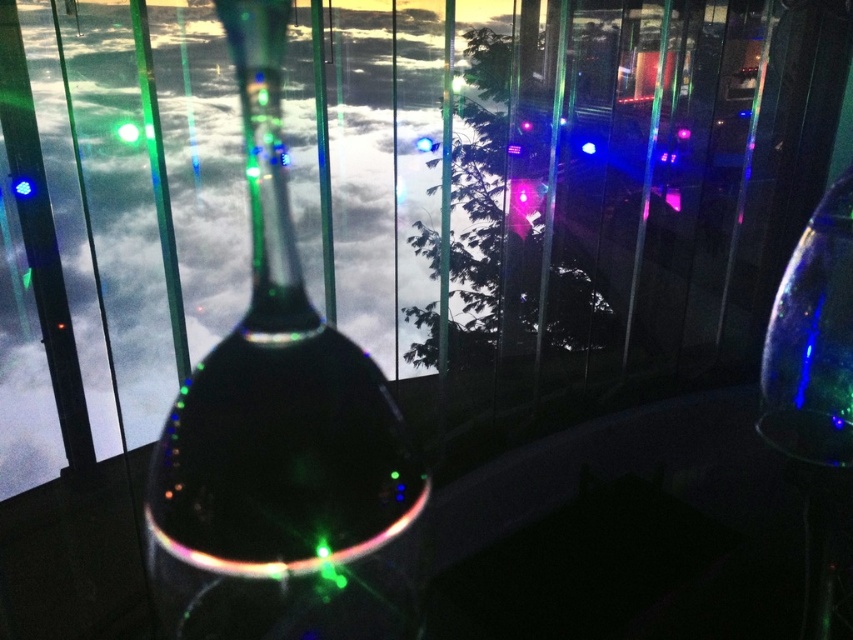
Question: Which point is farther to the camera?

Choices:
 (A) green translucent light at center
 (B) transparent glass wine glass at right
 (C) transparent glass bottle at center

Answer: (A)

Question: Is transparent glass wine glass at right wider than green translucent light at center?

Choices:
 (A) yes
 (B) no

Answer: (A)

Question: Is transparent glass bottle at center to the right of green translucent light at center from the viewer's perspective?

Choices:
 (A) no
 (B) yes

Answer: (B)

Question: Which point is closer to the camera taking this photo?

Choices:
 (A) (225, 540)
 (B) (773, 353)
 (C) (136, 132)

Answer: (A)

Question: Does transparent glass bottle at center have a larger size compared to transparent glass wine glass at right?

Choices:
 (A) yes
 (B) no

Answer: (B)

Question: Which of these objects is positioned closest to the green translucent light at center?

Choices:
 (A) transparent glass bottle at center
 (B) transparent glass wine glass at right

Answer: (A)